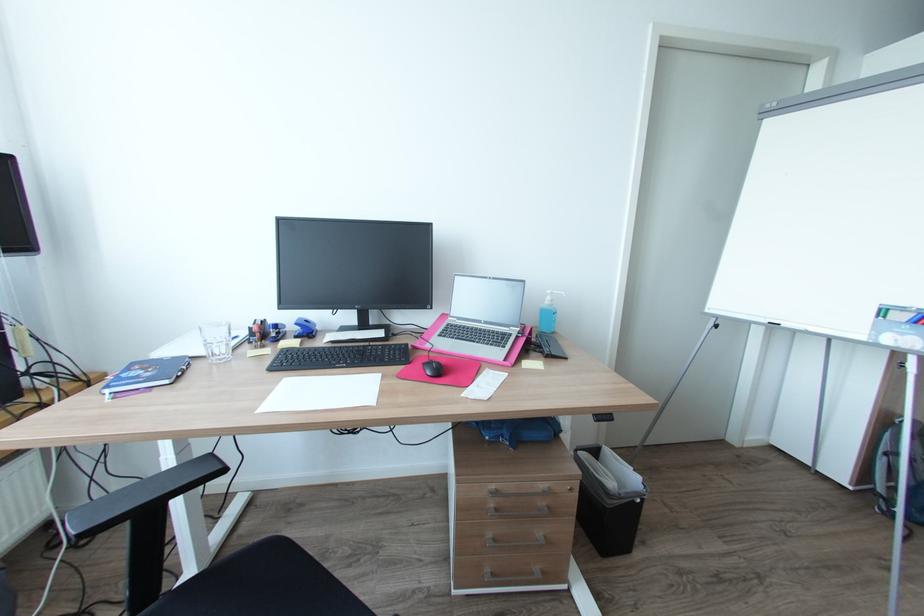
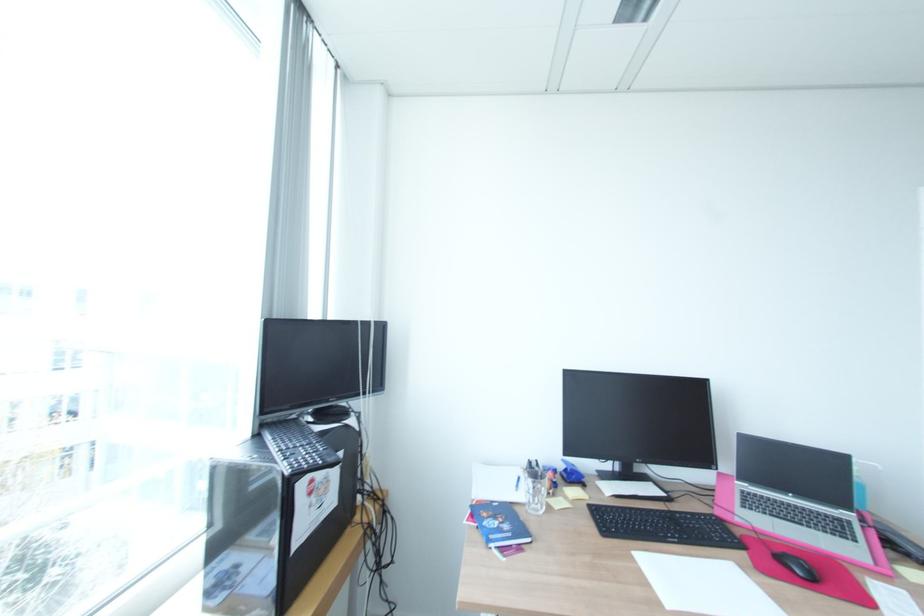
The point at (457, 338) is marked in the first image. Where is the corresponding point in the second image?

(770, 513)